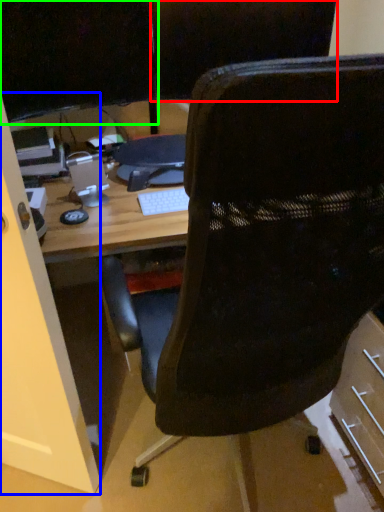
Question: Which object is positioned closest to back (highlighted by a red box)? Select from glass door (highlighted by a blue box) and computer monitor (highlighted by a green box).

Choices:
 (A) glass door
 (B) computer monitor

Answer: (B)